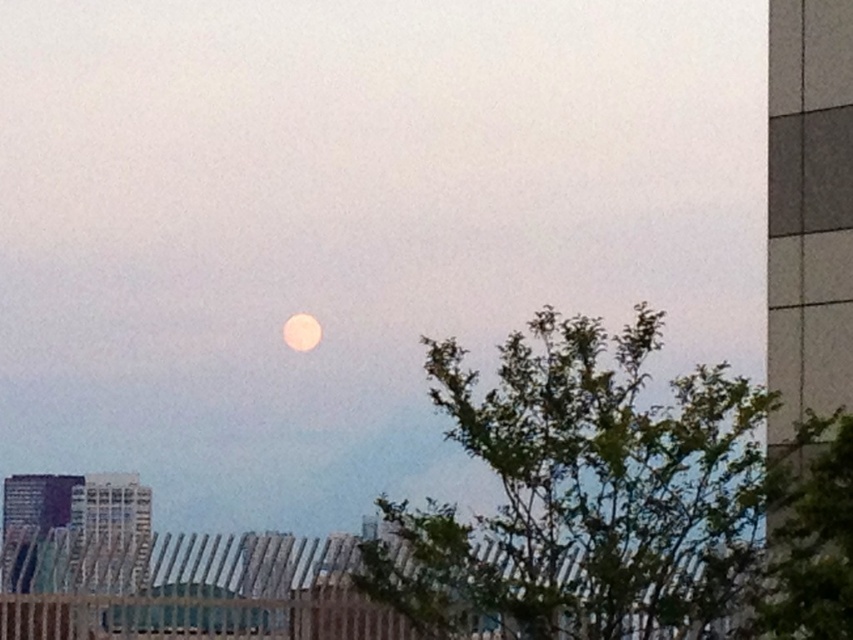
Question: Is green leafy tree at center closer to the viewer compared to smooth white moon at center?

Choices:
 (A) no
 (B) yes

Answer: (B)

Question: Which of the following is the farthest from the observer?

Choices:
 (A) green leafy tree at center
 (B) smooth white moon at center

Answer: (B)

Question: Does green leafy tree at center lie in front of smooth white moon at center?

Choices:
 (A) yes
 (B) no

Answer: (A)

Question: Which object is farther from the camera taking this photo?

Choices:
 (A) green leafy tree at center
 (B) smooth white moon at center

Answer: (B)

Question: Does green leafy tree at center have a larger size compared to smooth white moon at center?

Choices:
 (A) no
 (B) yes

Answer: (B)